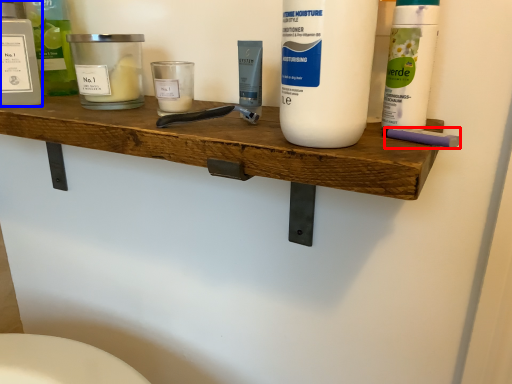
Question: Which object appears farthest to the camera in this image, personal care (highlighted by a red box) or personal care (highlighted by a blue box)?

Choices:
 (A) personal care
 (B) personal care

Answer: (B)